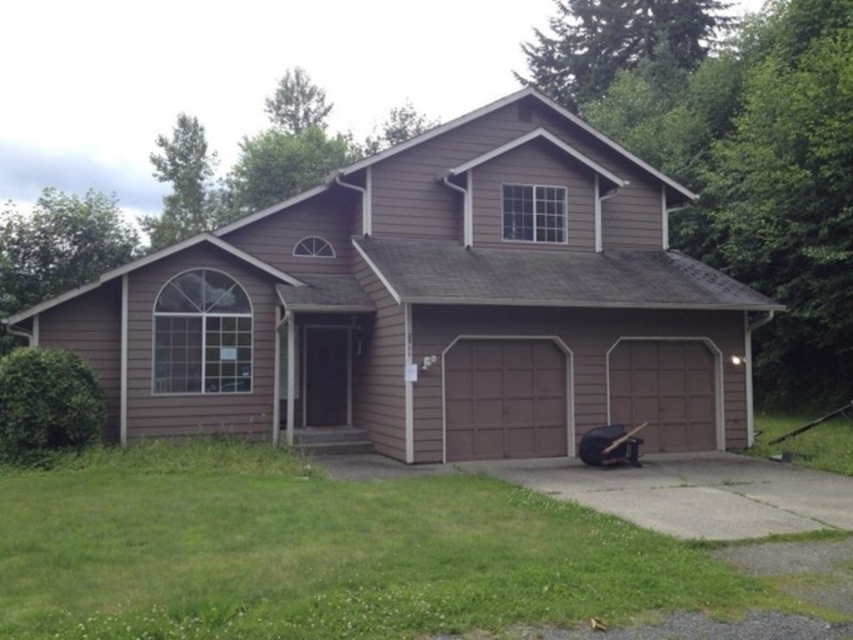
Question: Does brown wood garage at center appear over brown matte/glossy garage door at center?

Choices:
 (A) no
 (B) yes

Answer: (B)

Question: Which object appears closest to the camera in this image?

Choices:
 (A) brown wood garage at center
 (B) brown matte/glossy garage door at center

Answer: (A)

Question: Is brown wood garage at center smaller than brown matte/glossy garage door at center?

Choices:
 (A) yes
 (B) no

Answer: (B)

Question: Can you confirm if brown wood garage at center is wider than brown matte/glossy garage door at center?

Choices:
 (A) yes
 (B) no

Answer: (A)

Question: Among these points, which one is farthest from the camera?

Choices:
 (A) (270, 220)
 (B) (479, 353)

Answer: (A)